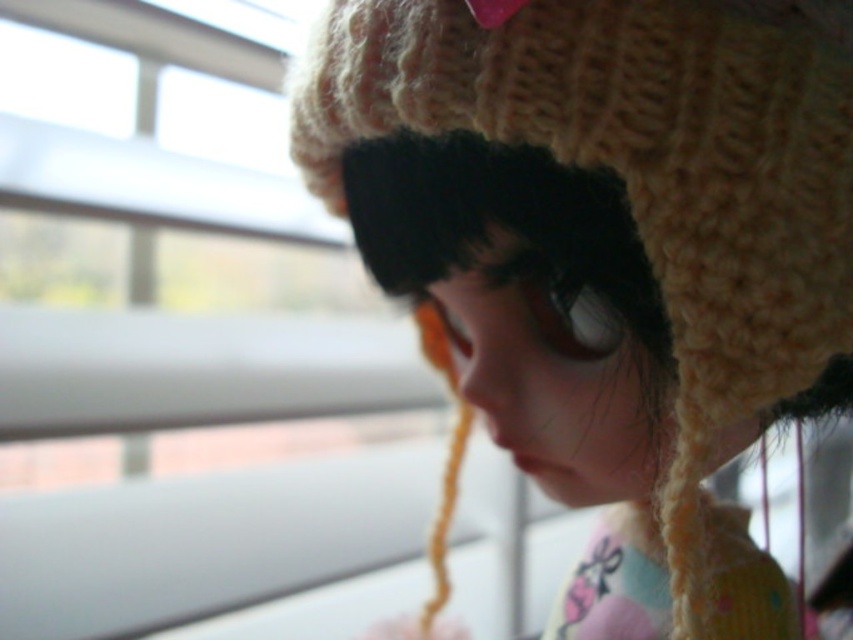
Does transparent glass window at upper left appear on the left side of knitted woolen hat at upper right?

Yes, transparent glass window at upper left is to the left of knitted woolen hat at upper right.

Does transparent glass window at upper left appear under knitted woolen hat at upper right?

Correct, transparent glass window at upper left is located below knitted woolen hat at upper right.

Does point (85, 586) come behind point (573, 154)?

Yes, point (85, 586) is farther from viewer.

Locate an element on the screen. The image size is (853, 640). transparent glass window at upper left is located at coordinates (210, 465).